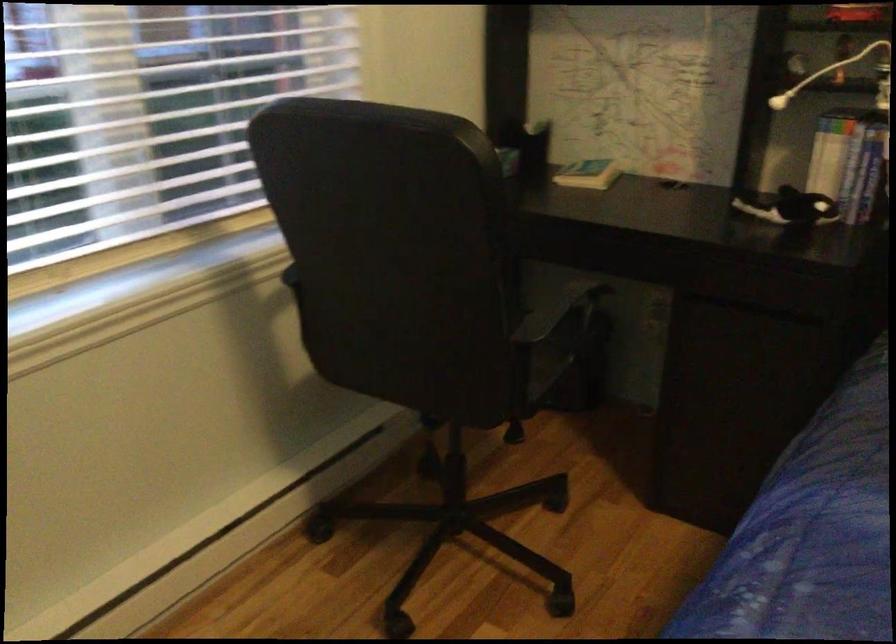
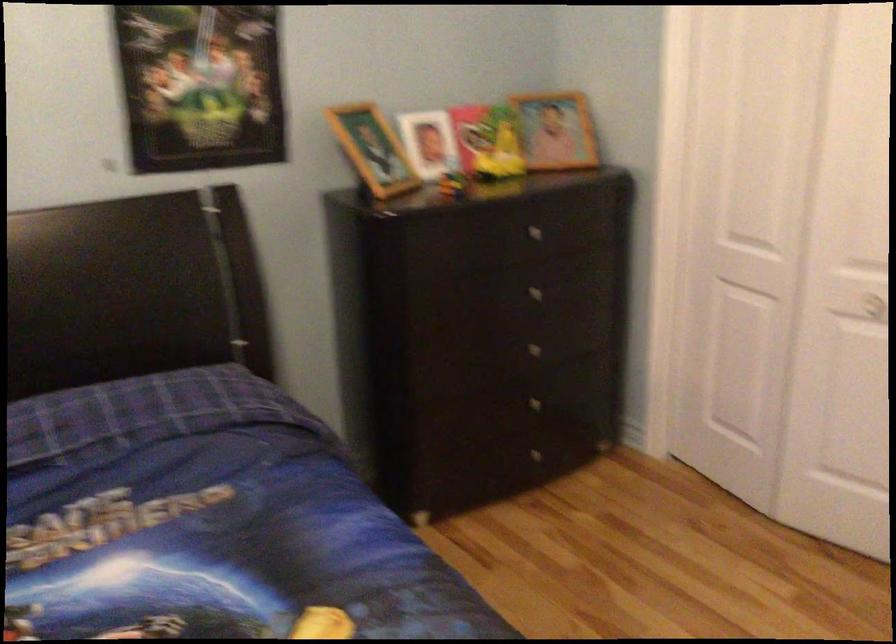
Question: The first image is from the beginning of the video and the second image is from the end. How did the camera likely rotate when shooting the video?

Choices:
 (A) Left
 (B) Right
 (C) Up
 (D) Down

Answer: (B)